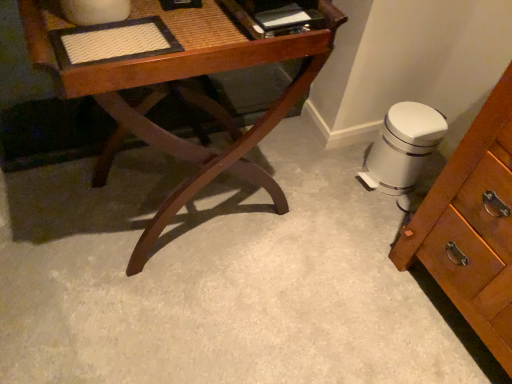
Where is `empty space that is to the right of glossy wood desk at center`? The width and height of the screenshot is (512, 384). empty space that is to the right of glossy wood desk at center is located at coordinates (321, 234).